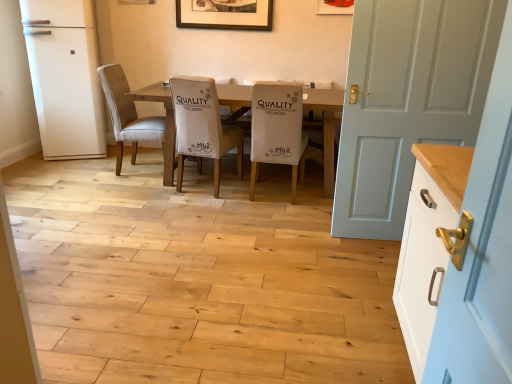
Locate an element on the screen. Image resolution: width=512 pixels, height=384 pixels. free space between suede beige chair at center, the 3th chair in the right-to-left sequence, and white painted wood cabinet at right is located at coordinates (249, 251).